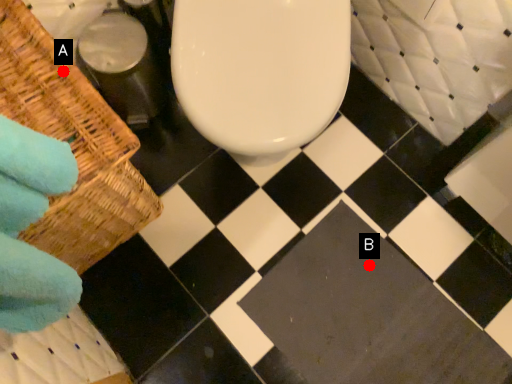
Question: Two points are circled on the image, labeled by A and B beside each circle. Among these points, which one is nearest to the camera?

Choices:
 (A) A is closer
 (B) B is closer

Answer: (A)